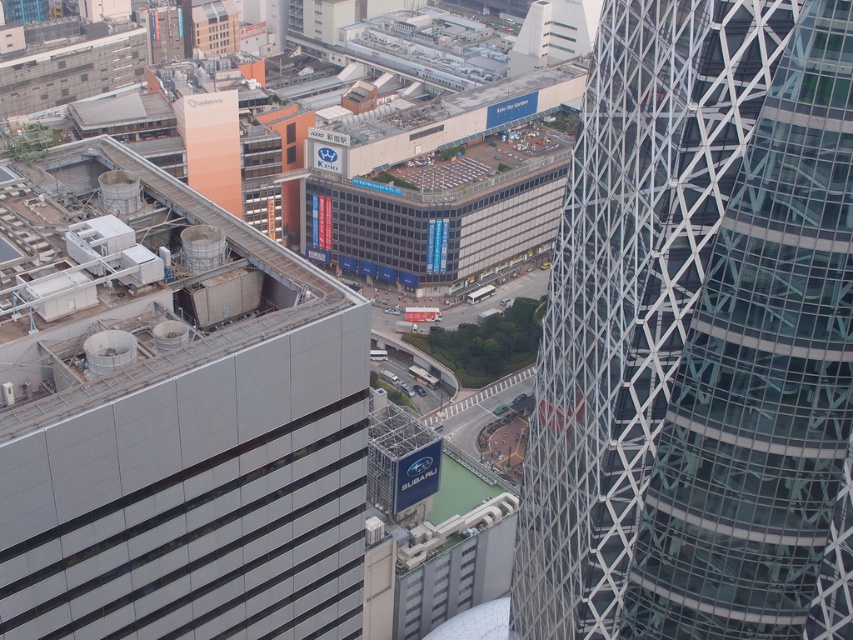
You are a drone operator tasked with delivering a package to the glassy steel tower at right. Your drone is currently hovering at the point with coordinates point (695, 328). Can you confirm if you are already above the glassy steel tower at right?

The point (695, 328) indicates the glassy steel tower at right, so yes, you are already above the glassy steel tower at right.

You are a city planner reviewing this urban layout. You need to determine the spatial relationship between the glassy steel tower at right and the metallic gray building at left. Which one is positioned lower in the image?

The glassy steel tower at right is located below metallic gray building at left, so it is positioned lower in the image.

You are a drone operator trying to capture a photo of the glassy steel tower at right and the metallic gray building at left. From your current position, which of the two buildings is closer to you?

The glassy steel tower at right is closer to you because it is positioned in front of the metallic gray building at left.